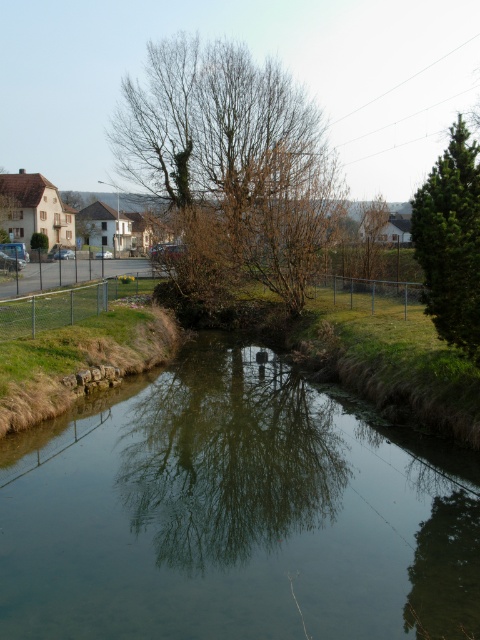
You are standing at the edge of the waterway and want to walk from the bare brown tree at center to the green textured pine tree at right. Which direction should you face to walk directly towards the pine tree?

The bare brown tree at center is positioned on the left side of the green textured pine tree at right, so you should face towards the right direction to walk directly towards the green textured pine tree at right.

You are standing in the rural scene and want to walk from point A to point B. Point A is at coordinate point (158,99) and point B is at coordinate point (425,196). Which direction should you head to reach point B from point A?

To reach point B from point A, you should head away from the viewer since point A is closer to the viewer than point B.

Consider the image. You are a bird looking for a place to perch. You see a bare brown tree at center and a green textured pine tree at right. Which tree would you choose if you prefer a taller perch?

The green textured pine tree at right is taller than the bare brown tree at center, so you should choose the green textured pine tree at right for a taller perch.